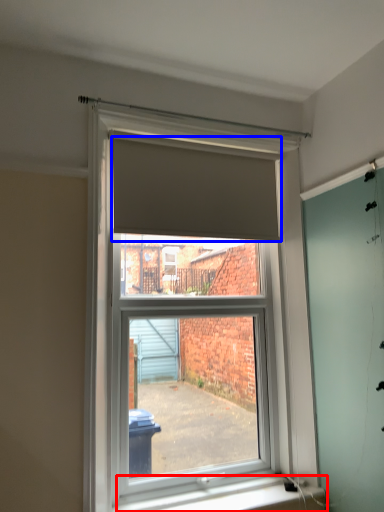
Question: Among these objects, which one is nearest to the camera, window sill (highlighted by a red box) or blind (highlighted by a blue box)?

Choices:
 (A) window sill
 (B) blind

Answer: (A)